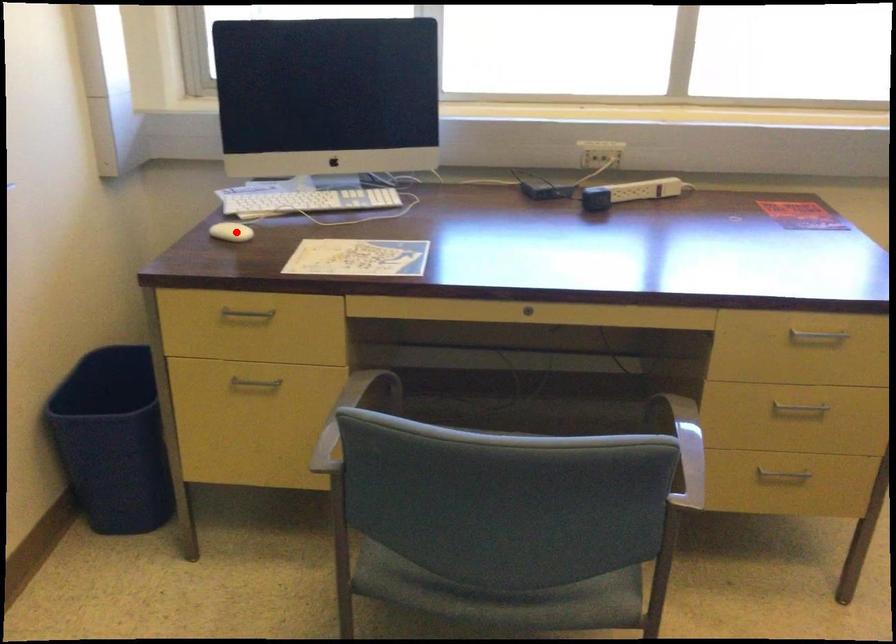
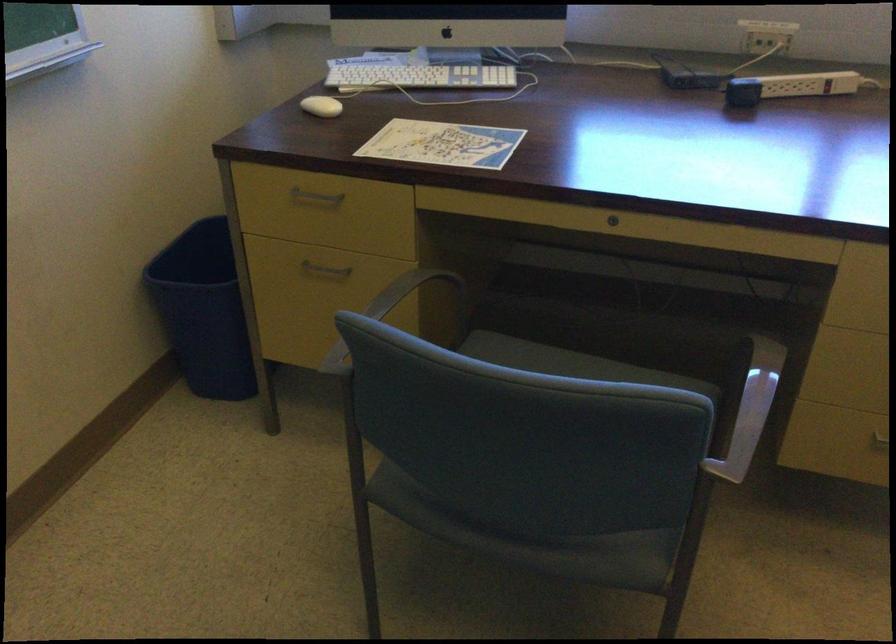
Question: I am providing you with two images of the same scene from different viewpoints. A red point is marked on the first image. Can you still see the location of the red point in image 2?

Choices:
 (A) Yes
 (B) No

Answer: (A)